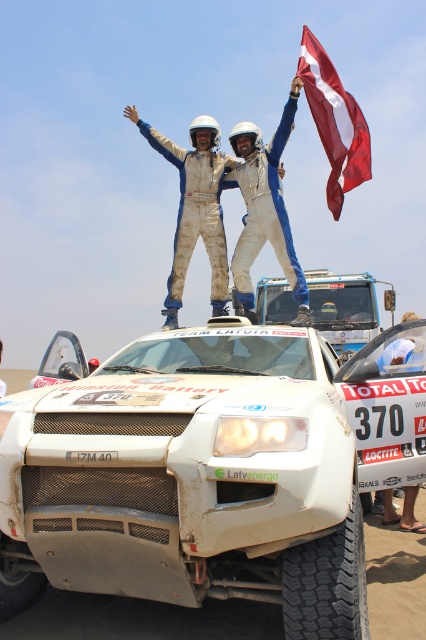
What is the location of the point with coordinates [187,476] in the image?

The point with coordinates [187,476] is located on the white matte rally car at center.

You are a photographer positioned at the center of the scene. You want to take a photo that includes both the red fabric flag at upper right and the Latvian flag held by one of the individuals. Based on their positions, which flag will appear closer to the edge of the photo?

The red fabric flag at upper right is located at point [334,122], so it will appear closer to the edge of the photo than the Latvian flag held by one of the individuals.